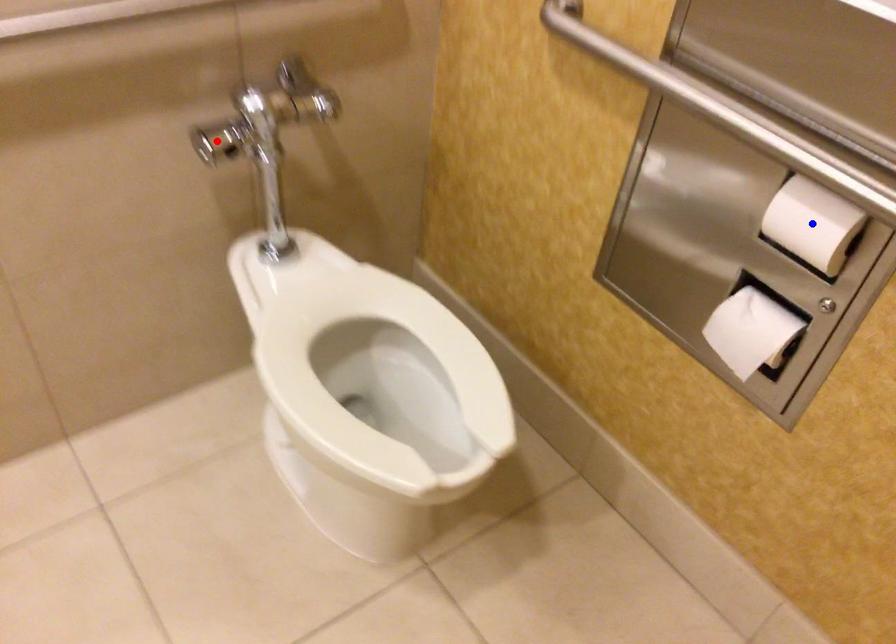
Question: Which of the two points in the image is closer to the camera?

Choices:
 (A) Blue point is closer.
 (B) Red point is closer.

Answer: (A)